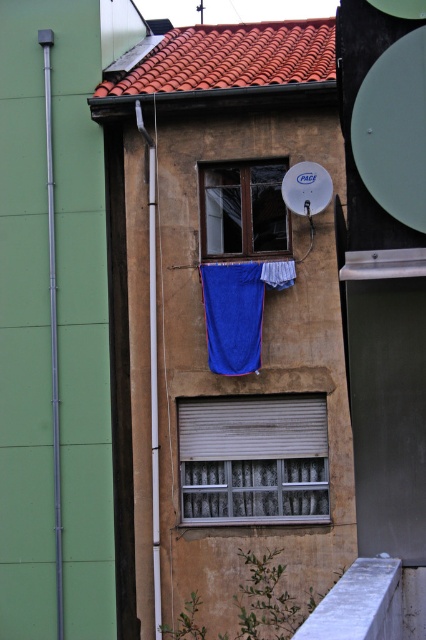
You are a window installer assessing the building. You need to replace the smaller window. Which window should you choose between the metallic silver window at center and the wooden window at center?

The wooden window at center is smaller, so you should choose it for replacement.

You are standing in front of the residential building described. A drone needs to hover exactly at the point labeled as point (210, 458). If the drone can only fly up to 20 meters away from you, will it be able to reach that point?

The point (210, 458) is 18.72 meters away from the camera, so yes, the drone can reach it since it is within the 20 meters range.

Based on the coordinates provided in the scene description, where is the metallic silver window at center located?

The metallic silver window at center is located at point (253, 458).